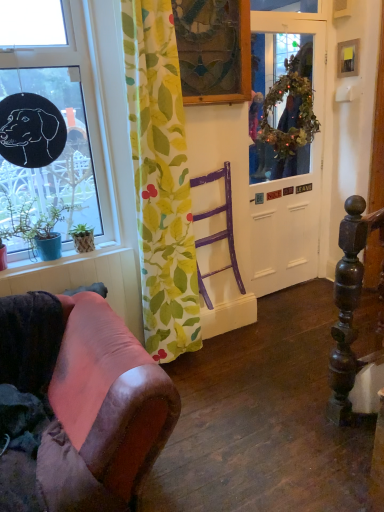
Based on the photo, what is the approximate height of leather armchair at lower left?

28.37 inches.

Where is `leather armchair at lower left`? This screenshot has width=384, height=512. leather armchair at lower left is located at coordinates (88, 398).

Find the location of `stained glass picture frame at upper center, arranged as the 2th picture frame when viewed from the right`. stained glass picture frame at upper center, arranged as the 2th picture frame when viewed from the right is located at coordinates (213, 50).

The width and height of the screenshot is (384, 512). What are the coordinates of `white matte door at center` in the screenshot? It's located at (284, 216).

Image resolution: width=384 pixels, height=512 pixels. Describe the element at coordinates (284, 216) in the screenshot. I see `white matte door at center` at that location.

What do you see at coordinates (78, 267) in the screenshot? The image size is (384, 512). I see `smooth wood window sill at lower left` at bounding box center [78, 267].

This screenshot has height=512, width=384. I want to click on green leafy fabric curtain at center, so click(161, 180).

In terms of height, does leather armchair at lower left look taller or shorter compared to green leafy fabric curtain at center?

In the image, leather armchair at lower left appears to be shorter than green leafy fabric curtain at center.

Is leather armchair at lower left in contact with green leafy fabric curtain at center?

No, leather armchair at lower left is not making contact with green leafy fabric curtain at center.

Is leather armchair at lower left bigger or smaller than green leafy fabric curtain at center?

In the image, leather armchair at lower left appears to be larger than green leafy fabric curtain at center.

Looking at this image, can green leafy fabric curtain at center be found inside leather armchair at lower left?

No, leather armchair at lower left does not contain green leafy fabric curtain at center.

Is white matte door at center facing away from wooden picture frame at upper right, the second picture frame when ordered from front to back?

That's not correct — white matte door at center is not looking away from wooden picture frame at upper right, the second picture frame when ordered from front to back.

Which of these two, white matte door at center or wooden picture frame at upper right, positioned as the 2th picture frame in left-to-right order, stands taller?

Standing taller between the two is white matte door at center.

Does point (297, 191) come behind point (354, 61)?

Yes, it is.

From the image's perspective, who appears lower, white matte door at center or wooden picture frame at upper right, acting as the first picture frame starting from the right?

white matte door at center, from the image's perspective.

Is black matte window at upper left facing towards green woven basket at left, placed as the first houseplant when sorted from right to left?

Yes, black matte window at upper left is oriented towards green woven basket at left, placed as the first houseplant when sorted from right to left.

Is black matte window at upper left closer to the viewer compared to green woven basket at left, which appears as the 2th houseplant when viewed from the left?

Yes, it is.

Between black matte window at upper left and green woven basket at left, placed as the first houseplant when sorted from right to left, which one has larger width?

With larger width is black matte window at upper left.

Between point (14, 80) and point (77, 247), which one is positioned behind?

The point (77, 247) is farther from the camera.

Is leather armchair at lower left facing towards green leafy wreath at upper right?

No, leather armchair at lower left is not aimed at green leafy wreath at upper right.

Looking at this image, from a real-world perspective, which is physically below, leather armchair at lower left or green leafy wreath at upper right?

leather armchair at lower left.

Does leather armchair at lower left appear on the left side of green leafy wreath at upper right?

Correct, you'll find leather armchair at lower left to the left of green leafy wreath at upper right.

The width and height of the screenshot is (384, 512). Identify the location of window below the green leafy wreath at upper right (from the image's perspective). (67, 130).

Which point is more distant from viewer, (x=18, y=49) or (x=306, y=153)?

The point (x=306, y=153) is farther from the camera.

Would you say black matte window at upper left is outside green leafy wreath at upper right?

black matte window at upper left lies outside green leafy wreath at upper right's area.

Looking at this image, does black matte window at upper left have a larger size compared to green leafy wreath at upper right?

Yes, black matte window at upper left is bigger than green leafy wreath at upper right.

From a real-world perspective, between white matte door at center and green leafy wreath at upper right, who is vertically lower?

white matte door at center, from a real-world perspective.

Considering the positions of objects white matte door at center and green leafy wreath at upper right in the image provided, who is more to the right, white matte door at center or green leafy wreath at upper right?

green leafy wreath at upper right.

The image size is (384, 512). Identify the location of door below the green leafy wreath at upper right (from a real-world perspective). (284, 216).

Is white matte door at center located outside green leafy wreath at upper right?

white matte door at center is positioned outside green leafy wreath at upper right.

Who is taller, green leafy wreath at upper right or smooth wood window sill at lower left?

Standing taller between the two is green leafy wreath at upper right.

Image resolution: width=384 pixels, height=512 pixels. I want to click on window screen behind the smooth wood window sill at lower left, so click(267, 99).

Is there a large distance between green leafy wreath at upper right and smooth wood window sill at lower left?

green leafy wreath at upper right is positioned a significant distance from smooth wood window sill at lower left.

Considering the relative positions of green leafy wreath at upper right and smooth wood window sill at lower left in the image provided, is green leafy wreath at upper right to the left of smooth wood window sill at lower left from the viewer's perspective?

Incorrect, green leafy wreath at upper right is not on the left side of smooth wood window sill at lower left.

Where is `chair that appears on the left of green leafy fabric curtain at center`? This screenshot has height=512, width=384. chair that appears on the left of green leafy fabric curtain at center is located at coordinates (88, 398).

Identify the location of door that is under the wooden picture frame at upper right, acting as the first picture frame starting from the right (from a real-world perspective). (284, 216).

When comparing their distances from black matte window at upper left, does wooden picture frame at upper right, acting as the first picture frame starting from the right, or smooth wood window sill at lower left seem further?

wooden picture frame at upper right, acting as the first picture frame starting from the right, is further to black matte window at upper left.

Looking at the image, which one is located closer to green leafy plant at left, marked as the 1th houseplant in a left-to-right arrangement, green leafy wreath at upper right or purple painted wood chair at center?

The object closer to green leafy plant at left, marked as the 1th houseplant in a left-to-right arrangement, is purple painted wood chair at center.

Estimate the real-world distances between objects in this image. Which object is closer to green leafy fabric curtain at center, green leafy wreath at upper right or stained glass picture frame at upper center, which is the second picture frame in back-to-front order?

stained glass picture frame at upper center, which is the second picture frame in back-to-front order, is closer to green leafy fabric curtain at center.

Estimate the real-world distances between objects in this image. Which object is further from black matte window at upper left, purple painted wood chair at center or wooden picture frame at upper right, the second picture frame when ordered from front to back?

Based on the image, wooden picture frame at upper right, the second picture frame when ordered from front to back, appears to be further to black matte window at upper left.

Looking at the image, which one is located further to purple painted wood chair at center, white matte door at center or green woven basket at left, which appears as the 2th houseplant when viewed from the left?

Based on the image, green woven basket at left, which appears as the 2th houseplant when viewed from the left, appears to be further to purple painted wood chair at center.

From the image, which object appears to be farther from green leafy fabric curtain at center, black matte window at upper left or stained glass picture frame at upper center, which ranks as the first picture frame in front-to-back order?

stained glass picture frame at upper center, which ranks as the first picture frame in front-to-back order, is further to green leafy fabric curtain at center.

Which object lies nearer to the anchor point wooden picture frame at upper right, placed as the first picture frame when sorted from back to front, leather armchair at lower left or white matte door at center?

Based on the image, white matte door at center appears to be nearer to wooden picture frame at upper right, placed as the first picture frame when sorted from back to front.

Which object lies further to the anchor point green leafy wreath at upper right, black matte window at upper left or stained glass picture frame at upper center, arranged as the 2th picture frame when viewed from the right?

black matte window at upper left is positioned further to the anchor green leafy wreath at upper right.

You are a GUI agent. You are given a task and a screenshot of the screen. Output one action in this format:
    pyautogui.click(x=<x>, y=<y>)
    Task: Click on the window sill between green leafy plant at left, marked as the 1th houseplant in a left-to-right arrangement, and green woven basket at left, placed as the first houseplant when sorted from right to left, from front to back
    
    Given the screenshot: What is the action you would take?
    pyautogui.click(x=78, y=267)

At what (x,y) coordinates should I click in order to perform the action: click on door that lies between stained glass picture frame at upper center, which is the second picture frame in back-to-front order, and purple painted wood chair at center from top to bottom. Please return your answer as a coordinate pair (x, y). This screenshot has width=384, height=512. Looking at the image, I should click on (284, 216).

Image resolution: width=384 pixels, height=512 pixels. I want to click on window screen between wooden picture frame at upper right, the second picture frame when ordered from front to back, and purple painted wood chair at center, in the vertical direction, so click(267, 99).

Locate an element on the screen. curtain that lies between wooden picture frame at upper right, the second picture frame when ordered from front to back, and leather armchair at lower left from top to bottom is located at coordinates (161, 180).